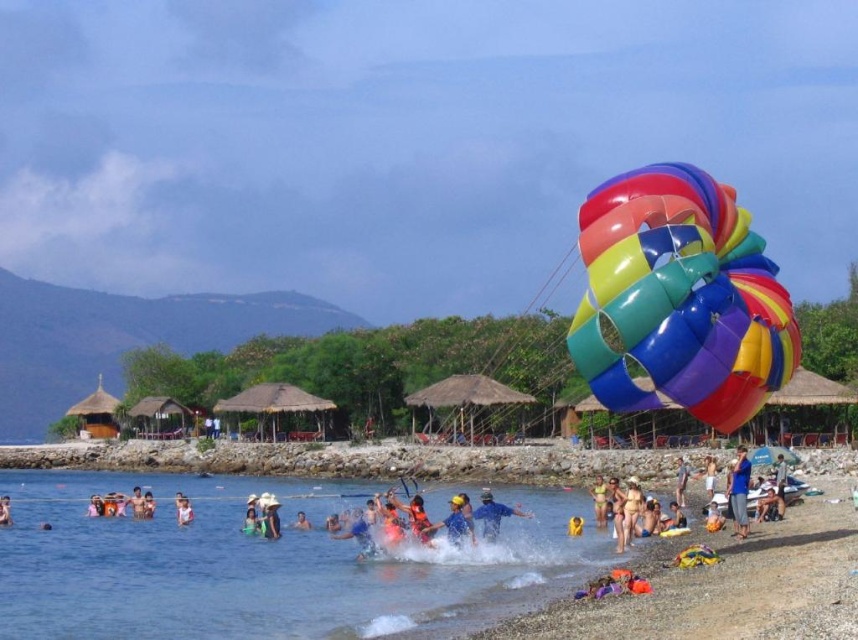
Question: Among these objects, which one is farthest from the camera?

Choices:
 (A) blue fabric swimmer at lower left
 (B) brown leather shorts at lower right
 (C) blue fabric shirt at center

Answer: (A)

Question: Is multicolored fabric people at lower right below blue fabric swimmer at lower left?

Choices:
 (A) yes
 (B) no

Answer: (B)

Question: Considering the real-world distances, which object is farthest from the blue fabric swimmer at lower center?

Choices:
 (A) blue matte shirt at center
 (B) brown leather shorts at lower right

Answer: (B)

Question: Which point is closer to the camera?

Choices:
 (A) brown leather shorts at lower right
 (B) multicolored fabric people at lower right
 (C) blue fabric swimmer at lower center
 (D) blue fabric shirt at center

Answer: (D)

Question: Observing the image, what is the correct spatial positioning of blue fabric person at center in reference to blue fabric swimmer at lower center?

Choices:
 (A) left
 (B) right

Answer: (B)

Question: Is blue fabric shirt at center thinner than blue fabric swimmer at lower left?

Choices:
 (A) yes
 (B) no

Answer: (B)